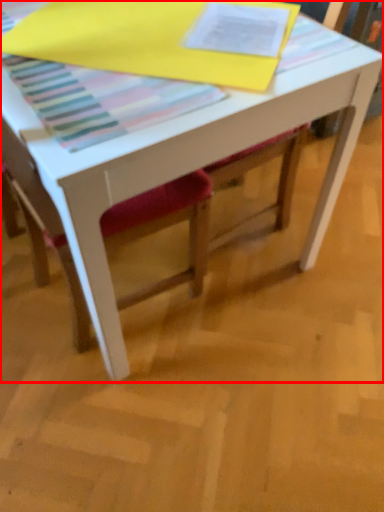
Question: Where is table (annotated by the red box) located in relation to chair in the image?

Choices:
 (A) right
 (B) left

Answer: (A)